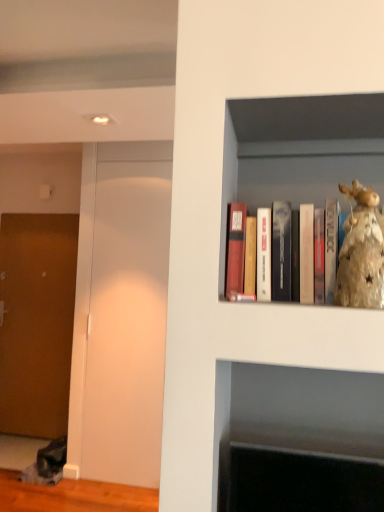
The height and width of the screenshot is (512, 384). Find the location of `vacant area situated below brown textured door at left (from a real-world perspective)`. vacant area situated below brown textured door at left (from a real-world perspective) is located at coordinates (26, 438).